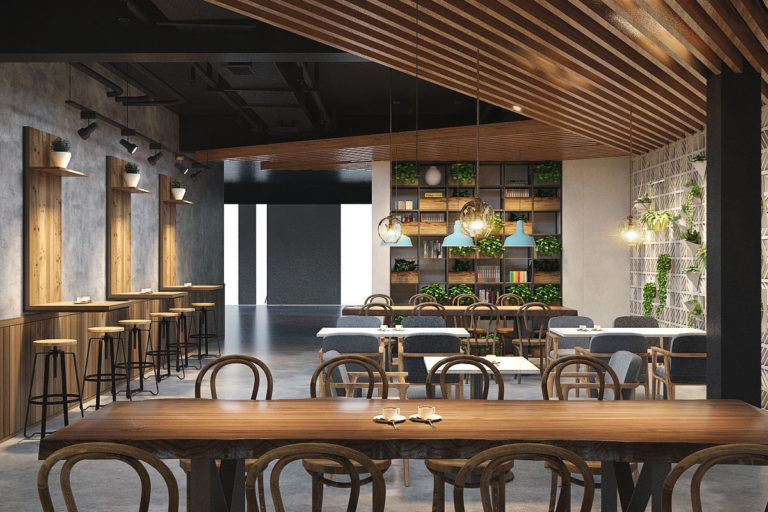
The height and width of the screenshot is (512, 768). What are the coordinates of `table tops` in the screenshot? It's located at (98, 305), (169, 293), (203, 289), (358, 332), (461, 308), (644, 333), (543, 426).